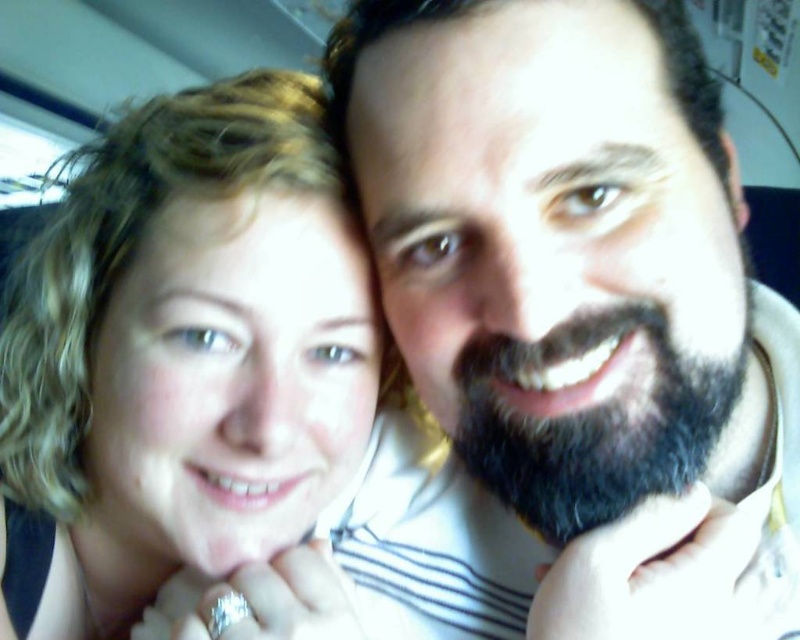
Does blonde hair at left have a lesser height compared to dark brown fuzzy beard at center?

Incorrect, blonde hair at left's height does not fall short of dark brown fuzzy beard at center's.

In the scene shown: Is blonde hair at left smaller than dark brown fuzzy beard at center?

No, blonde hair at left is not smaller than dark brown fuzzy beard at center.

Between point (281, 72) and point (616, 467), which one is positioned in front?

Point (616, 467)

I want to click on blonde hair at left, so click(182, 356).